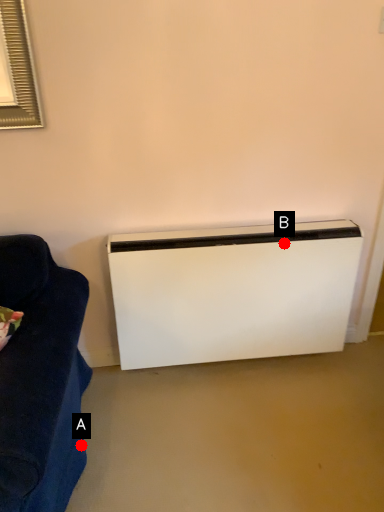
Question: Two points are circled on the image, labeled by A and B beside each circle. Among these points, which one is nearest to the camera?

Choices:
 (A) A is closer
 (B) B is closer

Answer: (A)